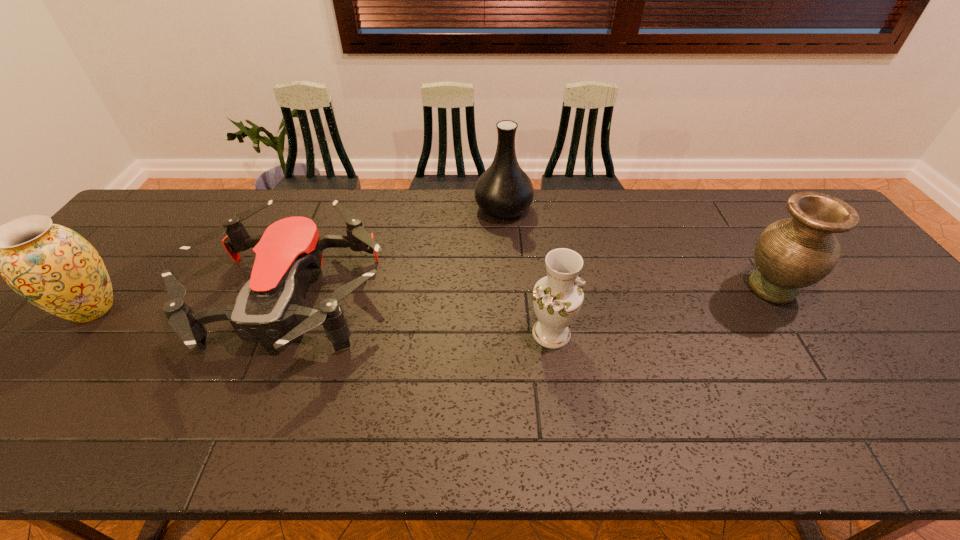
Find the location of `the third closest vase relative to the shortest object`. the third closest vase relative to the shortest object is located at coordinates (557, 298).

Where is `vase that can be found as the third closest to the leftmost vase`? The image size is (960, 540). vase that can be found as the third closest to the leftmost vase is located at coordinates (792, 253).